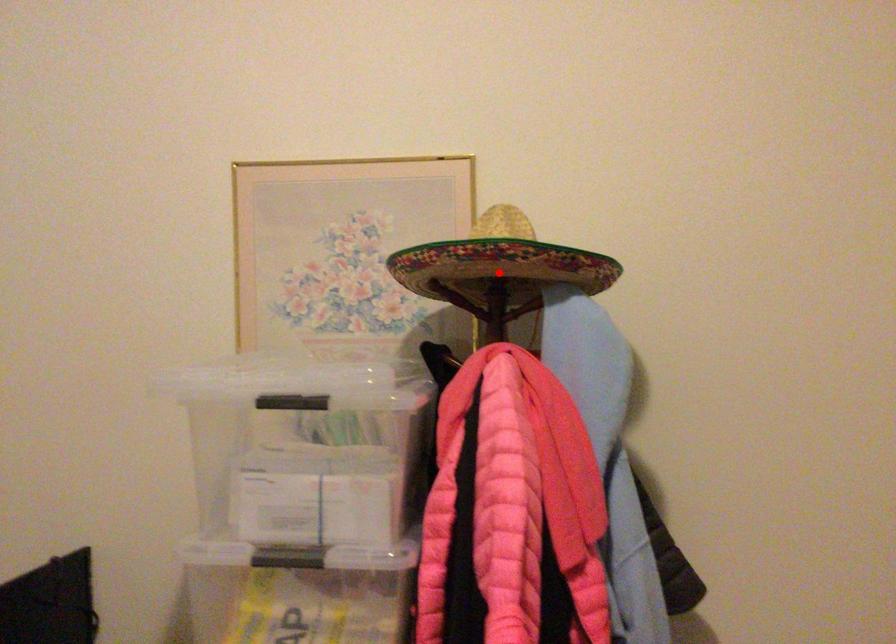
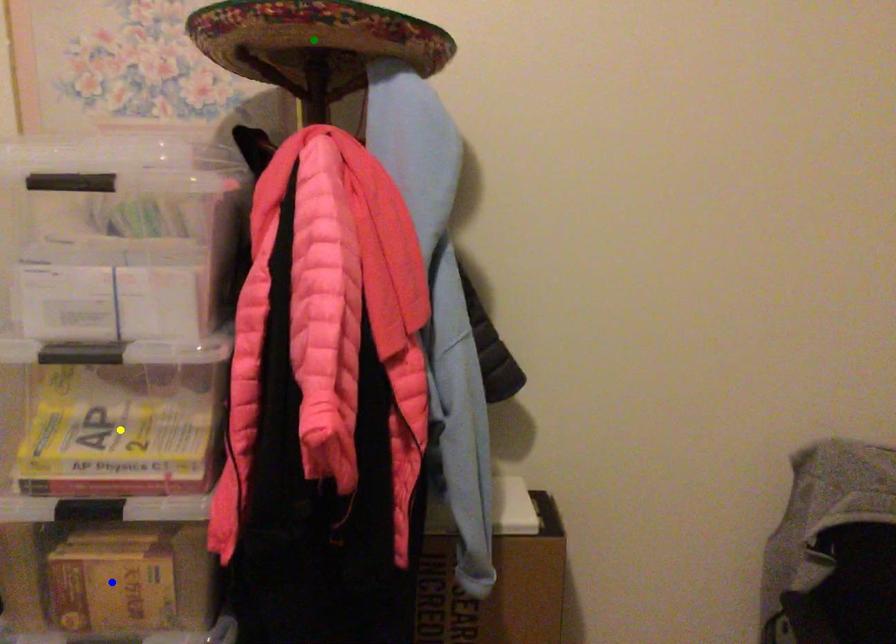
Question: I am providing you with two images of the same scene from different viewpoints. A red point is marked on the first image. You are given multiple points on the second image. In image 2, which mark is for the same physical point as the one in image 1?

Choices:
 (A) green point
 (B) yellow point
 (C) blue point

Answer: (A)